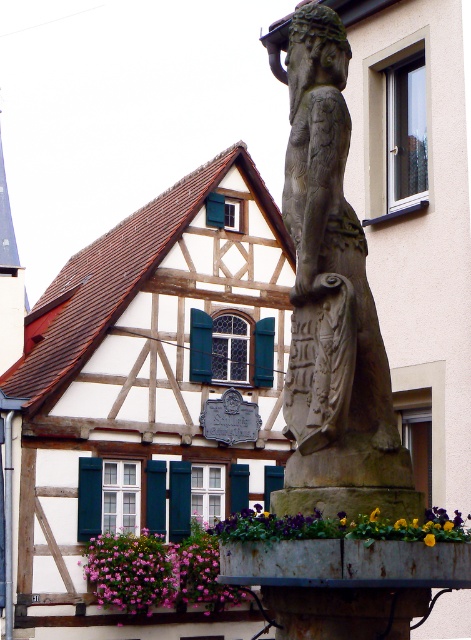
Question: Can you confirm if rusty metal flower box at center is thinner than pink fabric flowers at lower left?

Choices:
 (A) no
 (B) yes

Answer: (B)

Question: Among these objects, which one is nearest to the camera?

Choices:
 (A) green painted wood shutter at center
 (B) stone statue at center
 (C) green matte shutter at center
 (D) purple fabric flower at center

Answer: (D)

Question: Which point is closer to the camera?

Choices:
 (A) stone statue at center
 (B) pink fabric flowers at lower left
 (C) green painted wood shutter at center

Answer: (A)

Question: Estimate the real-world distances between objects in this image. Which object is closer to the rusty metal flower box at center?

Choices:
 (A) stone statue at center
 (B) green painted wood shutter at center
 (C) green matte shutter at center

Answer: (A)

Question: Can you confirm if stone statue at center is positioned above green matte shutter at center?

Choices:
 (A) no
 (B) yes

Answer: (B)

Question: Is purple fabric flower at center bigger than green painted wood shutter at center?

Choices:
 (A) yes
 (B) no

Answer: (A)